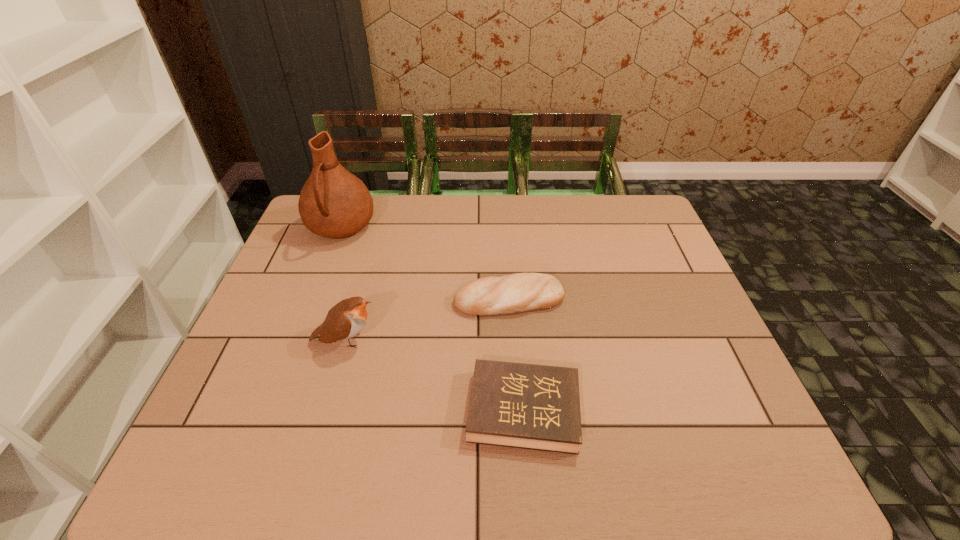
I want to click on free space located 0.320m on the left of the bread, so click(x=335, y=299).

Locate an element on the screen. The image size is (960, 540). free space located on the left of the hardback book is located at coordinates (358, 410).

This screenshot has width=960, height=540. I want to click on object that is at the far edge, so click(x=333, y=203).

At what (x,y) coordinates should I click in order to perform the action: click on object that is at the near edge. Please return your answer as a coordinate pair (x, y). This screenshot has width=960, height=540. Looking at the image, I should click on (528, 406).

What are the coordinates of `pitcher that is positioned at the left edge` in the screenshot? It's located at (333, 203).

Locate an element on the screen. Image resolution: width=960 pixels, height=540 pixels. bird at the left edge is located at coordinates (346, 319).

Identify the location of object at the far left corner. The width and height of the screenshot is (960, 540). (333, 203).

Find the location of a particular element. This screenshot has width=960, height=540. free space at the far edge of the desktop is located at coordinates click(x=456, y=200).

Image resolution: width=960 pixels, height=540 pixels. Identify the location of vacant space at the near edge. (663, 440).

The image size is (960, 540). I want to click on vacant region at the left edge of the desktop, so click(x=346, y=239).